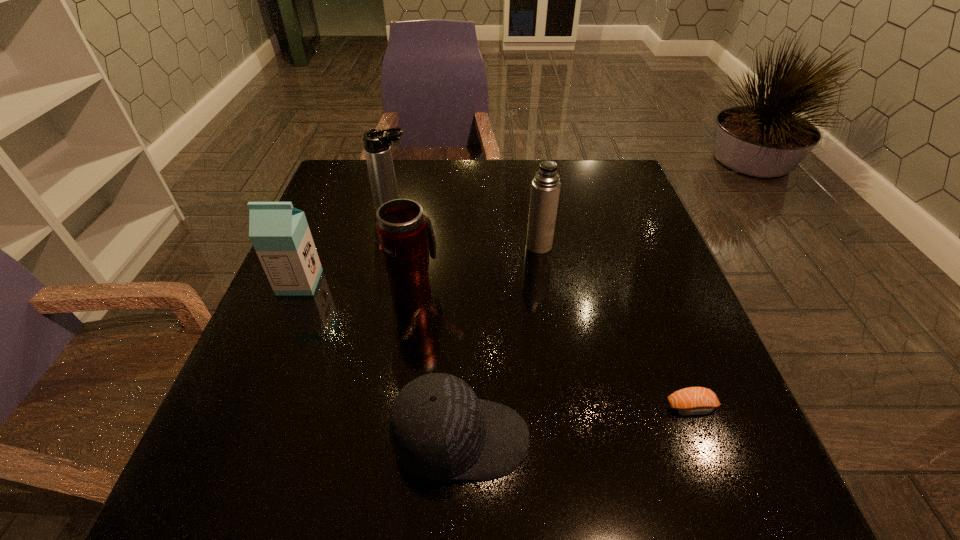
Find the location of `unoccupied area between the fifth tallest object and the rightmost object`. unoccupied area between the fifth tallest object and the rightmost object is located at coordinates [576, 423].

Locate an element on the screen. This screenshot has height=540, width=960. free space between the farthest object and the second shortest object is located at coordinates (427, 324).

Find the location of a particular element. unoccupied area between the nearest thermos bottle and the fifth nearest object is located at coordinates (477, 269).

Locate an element on the screen. free spot between the baseball cap and the nearest thermos bottle is located at coordinates (438, 366).

You are a GUI agent. You are given a task and a screenshot of the screen. Output one action in this format:
    pyautogui.click(x=<x>, y=<y>)
    Task: Click on the fifth closest object to the nearest thermos bottle
    This screenshot has width=960, height=540.
    Given the screenshot: What is the action you would take?
    pyautogui.click(x=689, y=401)

Identify which object is the fifth closest to the farthest object. Please provide its 2D coordinates. Your answer should be formatted as a tuple, i.e. [(x, y)], where the tuple contains the x and y coordinates of a point satisfying the conditions above.

[(689, 401)]

Locate which thermos bottle is the second closest to the farthest object. Please provide its 2D coordinates. Your answer should be formatted as a tuple, i.e. [(x, y)], where the tuple contains the x and y coordinates of a point satisfying the conditions above.

[(545, 189)]

Identify which thermos bottle is the second closest to the second farthest object. Please provide its 2D coordinates. Your answer should be formatted as a tuple, i.e. [(x, y)], where the tuple contains the x and y coordinates of a point satisfying the conditions above.

[(377, 148)]

Locate an element on the screen. The width and height of the screenshot is (960, 540). free region that satisfies the following two spatial constraints: 1. on the handle side of the farthest thermos bottle; 2. on the left side of the rightmost thermos bottle is located at coordinates (385, 246).

This screenshot has height=540, width=960. Identify the location of vacant space that satisfies the following two spatial constraints: 1. on the handle side of the farthest thermos bottle; 2. on the back side of the second nearest thermos bottle. (385, 246).